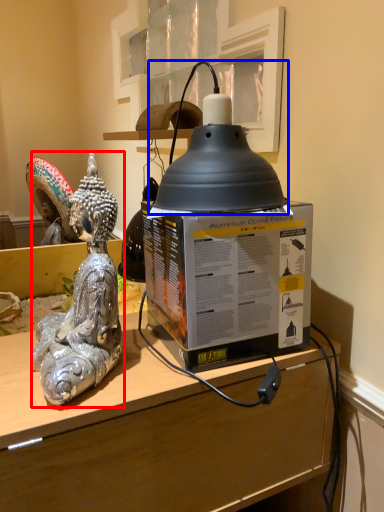
Question: Which object is closer to the camera taking this photo, figurine (highlighted by a red box) or oil lamp (highlighted by a blue box)?

Choices:
 (A) figurine
 (B) oil lamp

Answer: (A)